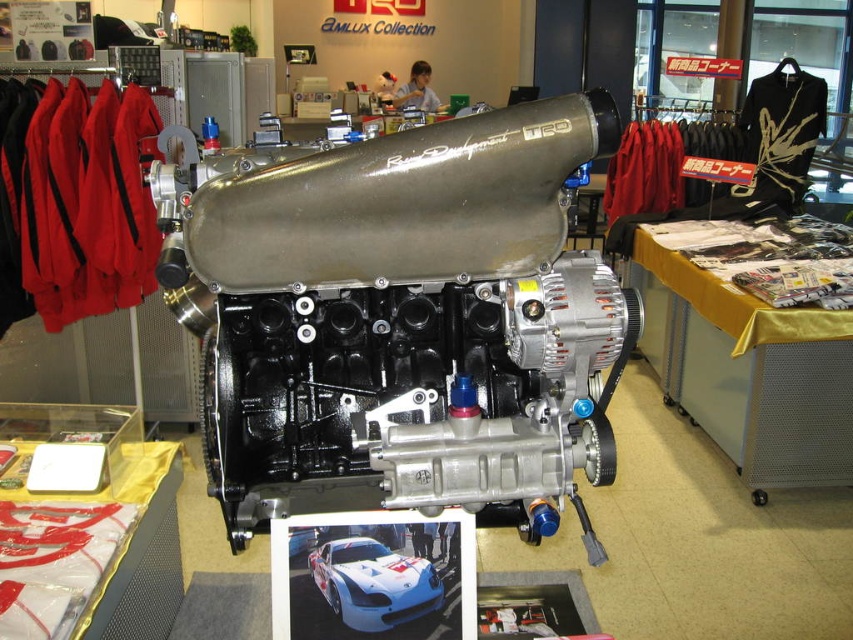
Does silver metallic engine at center appear on the right side of white glossy car at center?

Indeed, silver metallic engine at center is positioned on the right side of white glossy car at center.

Is point (502, 276) closer to camera compared to point (392, 596)?

Yes, it is.

What are the coordinates of `silver metallic engine at center` in the screenshot? It's located at (401, 317).

Where is `silver metallic engine at center`? This screenshot has width=853, height=640. silver metallic engine at center is located at coordinates (x=401, y=317).